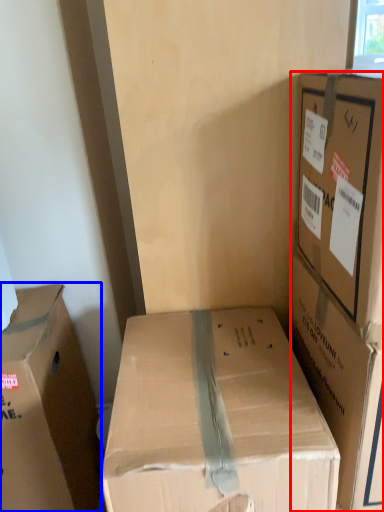
Question: Which object appears closest to the camera in this image, box (highlighted by a red box) or box (highlighted by a blue box)?

Choices:
 (A) box
 (B) box

Answer: (A)